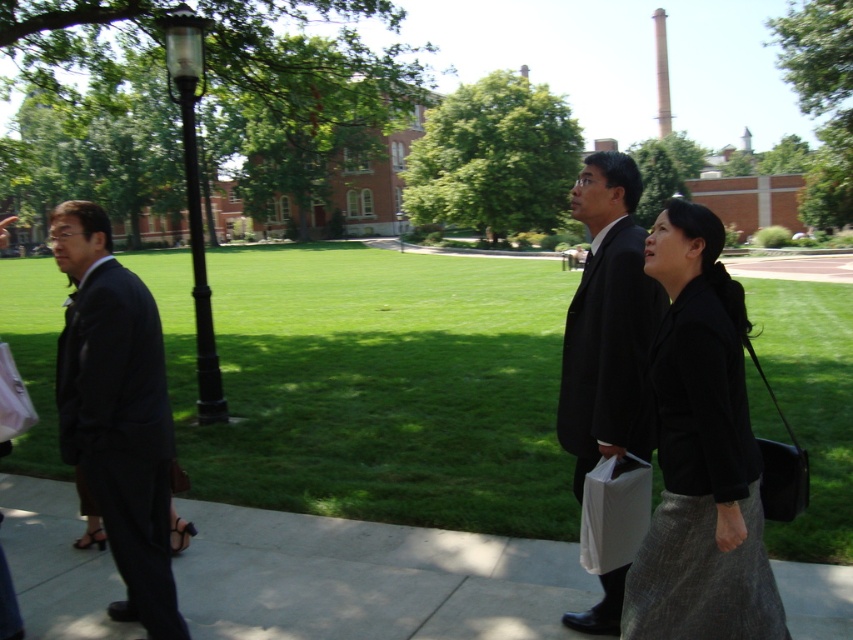
Question: Based on their relative distances, which object is farther from the matte black suit at left?

Choices:
 (A) green grass at center
 (B) black textured blazer at center
 (C) concrete sidewalk at lower center

Answer: (A)

Question: Which object is the closest to the black matte suit at center?

Choices:
 (A) concrete sidewalk at lower center
 (B) matte black suit at left
 (C) black textured blazer at center
 (D) green grass at center

Answer: (C)

Question: Which is farther from the concrete sidewalk at lower center?

Choices:
 (A) green grass at center
 (B) matte black suit at left
 (C) black textured blazer at center
 (D) black matte suit at center

Answer: (A)

Question: Does green grass at center have a smaller size compared to black textured blazer at center?

Choices:
 (A) yes
 (B) no

Answer: (B)

Question: Can you confirm if black textured blazer at center is wider than matte black suit at left?

Choices:
 (A) yes
 (B) no

Answer: (B)

Question: Considering the relative positions of concrete sidewalk at lower center and matte black suit at left in the image provided, where is concrete sidewalk at lower center located with respect to matte black suit at left?

Choices:
 (A) right
 (B) left

Answer: (A)